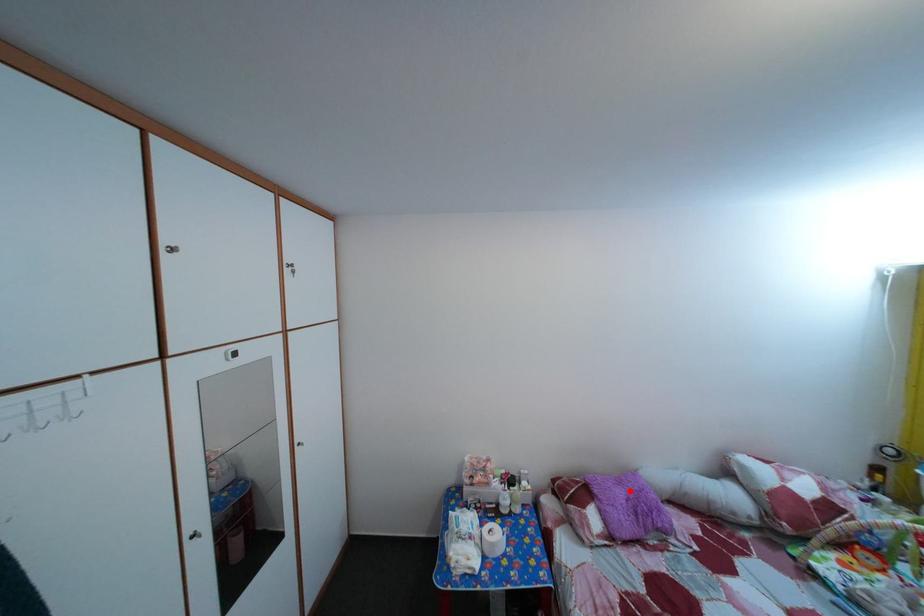
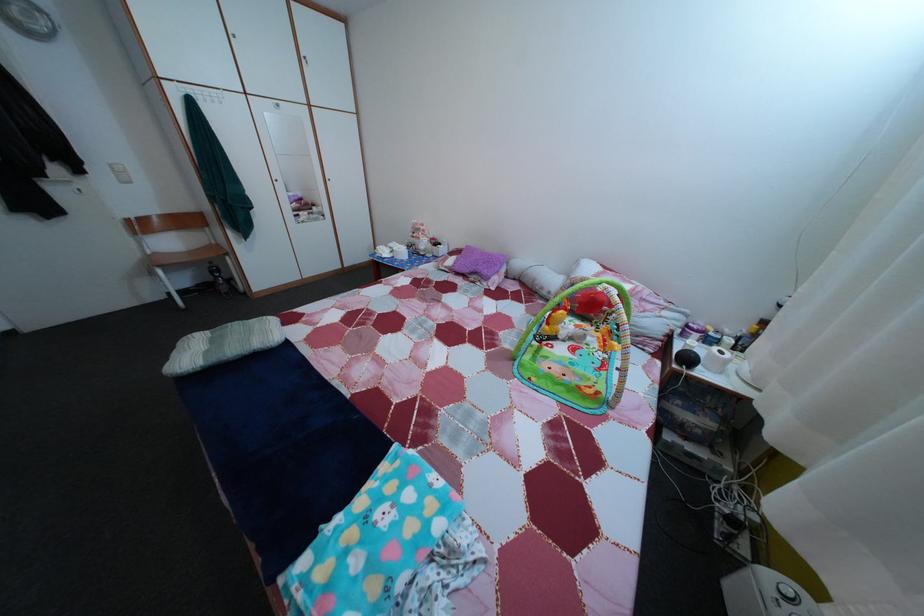
The point at the highlighted location is marked in the first image. Where is the corresponding point in the second image?

(492, 261)